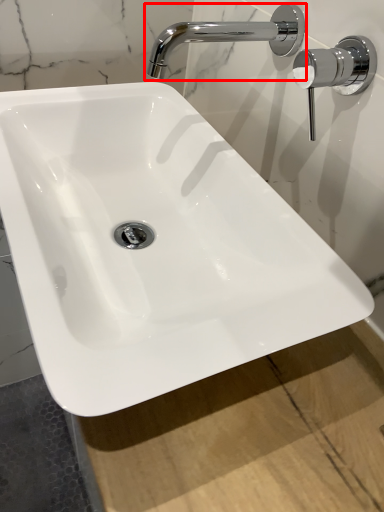
Question: From the image's perspective, what is the correct spatial relationship of tap (annotated by the red box) in relation to door handle?

Choices:
 (A) above
 (B) below

Answer: (A)